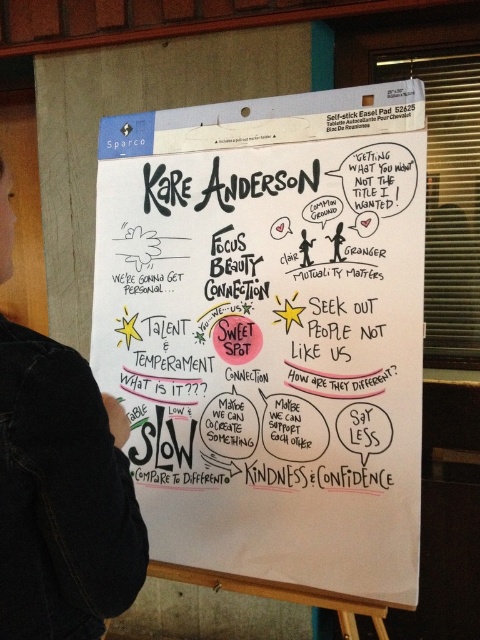
Describe the element at coordinates (269, 332) in the screenshot. I see `white paper at center` at that location.

Which is in front, point (134, 465) or point (82, 595)?

Point (82, 595)

Locate an element on the screen. white paper at center is located at coordinates (269, 332).